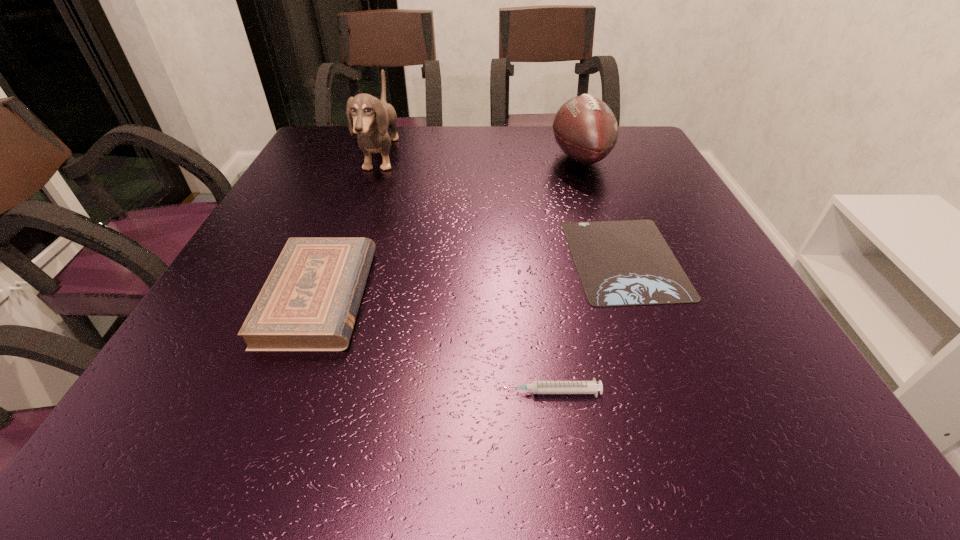
Find the location of a particular element. free region located 0.070m at the needle end of the fourth tallest object is located at coordinates (451, 392).

What are the coordinates of `vacant space located 0.050m at the needle end of the fourth tallest object` in the screenshot? It's located at 465,392.

Find the location of a particular element. The image size is (960, 540). blank area located 0.160m on the left of the mousepad is located at coordinates (490, 259).

Image resolution: width=960 pixels, height=540 pixels. Identify the location of puppy that is at the far edge. (372, 117).

Locate an element on the screen. This screenshot has width=960, height=540. football (American) present at the far edge is located at coordinates (585, 128).

Find the location of a particular element. This screenshot has height=540, width=960. object at the near edge is located at coordinates (537, 387).

Find the location of a particular element. Image resolution: width=960 pixels, height=540 pixels. object situated at the left edge is located at coordinates (310, 300).

Where is `football (American) that is at the right edge`? This screenshot has width=960, height=540. football (American) that is at the right edge is located at coordinates (585, 128).

Find the location of `mousepad at the right edge`. mousepad at the right edge is located at coordinates (620, 263).

Find the location of `object that is at the far right corner`. object that is at the far right corner is located at coordinates (585, 128).